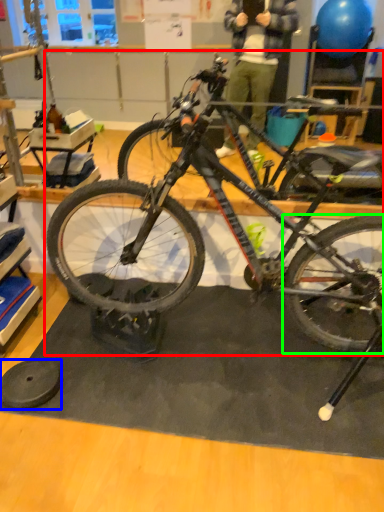
Question: Considering the real-world distances, which object is farthest from bicycle (highlighted by a red box)? wheel (highlighted by a blue box) or bicycle wheel (highlighted by a green box)?

Choices:
 (A) wheel
 (B) bicycle wheel

Answer: (A)